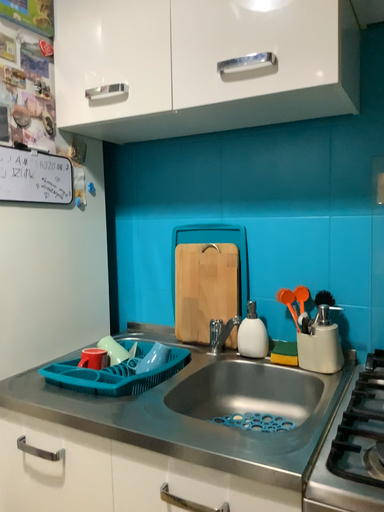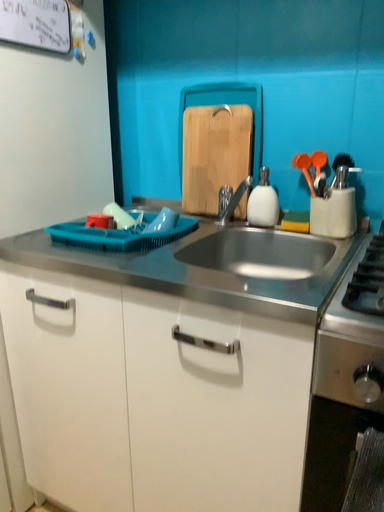
Question: How did the camera likely rotate when shooting the video?

Choices:
 (A) rotated downward
 (B) rotated upward

Answer: (A)